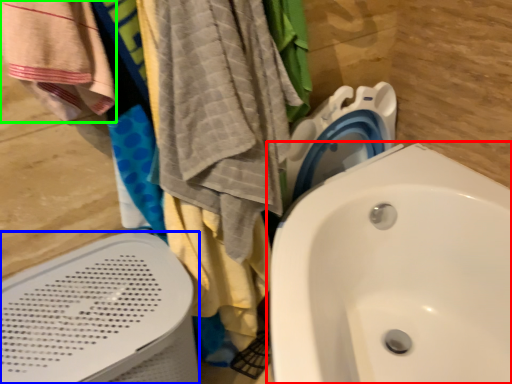
Question: Considering the real-world distances, which object is closest to sink (highlighted by a red box)? bath heater (highlighted by a blue box) or beach towel (highlighted by a green box).

Choices:
 (A) bath heater
 (B) beach towel

Answer: (A)